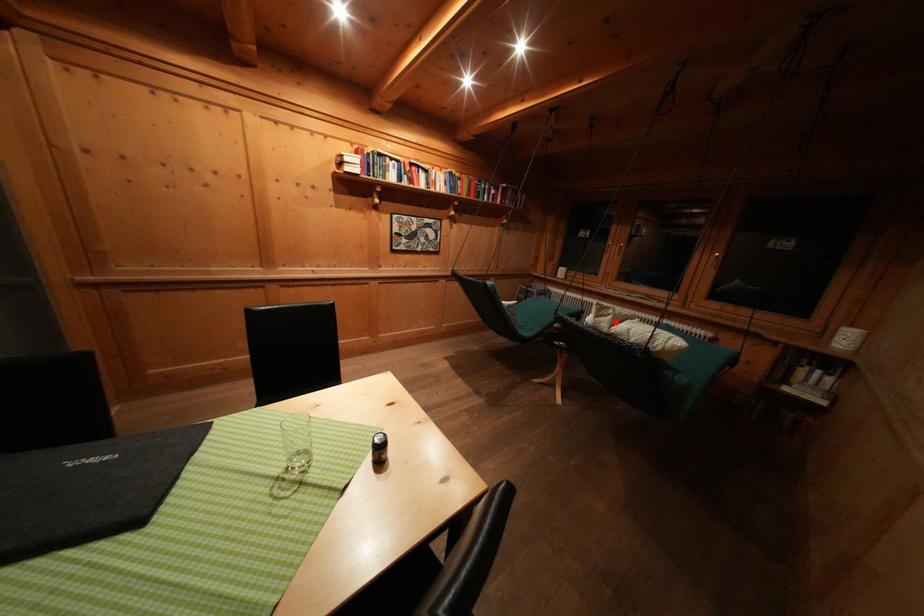
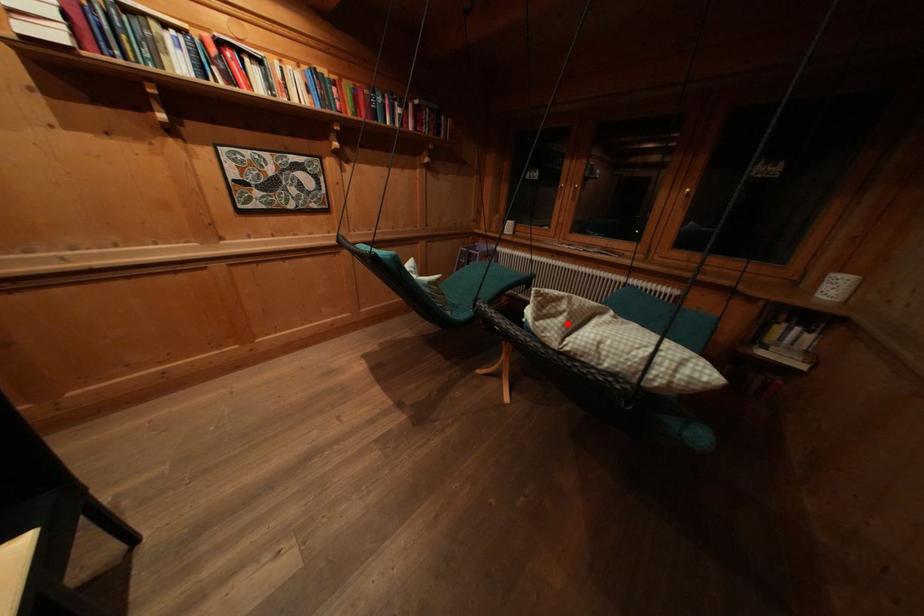
I am providing you with two images of the same scene from different viewpoints. A red point is marked on the first image and another point is marked on the second image. Do the highlighted points in image1 and image2 indicate the same real-world spot?

Yes